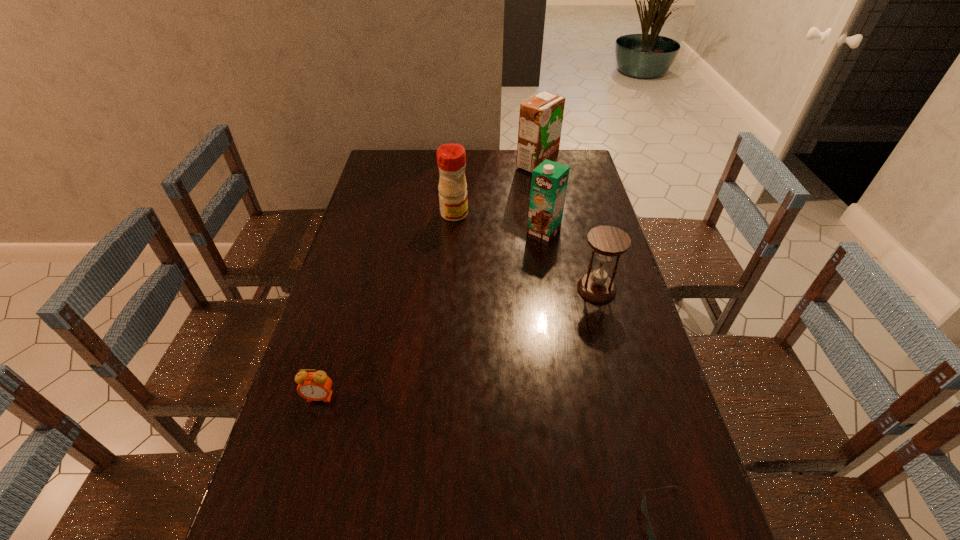
Locate an element on the screen. The width and height of the screenshot is (960, 540). vacant space located on the right of the second object from left to right is located at coordinates (512, 214).

You are a GUI agent. You are given a task and a screenshot of the screen. Output one action in this format:
    pyautogui.click(x=<x>, y=<y>)
    Task: Click on the free space located on the front of the nearer carton
    
    Given the screenshot: What is the action you would take?
    pyautogui.click(x=557, y=309)

Locate an element on the screen. vacant space situated 0.330m on the left of the third shortest object is located at coordinates (468, 289).

Where is `vacant area located 0.200m on the face of the fifth farthest object`? vacant area located 0.200m on the face of the fifth farthest object is located at coordinates (292, 489).

Where is `object at the far edge`? object at the far edge is located at coordinates (540, 120).

This screenshot has width=960, height=540. Identify the location of object that is positioned at the left edge. (314, 386).

Where is `carton at the right edge`? carton at the right edge is located at coordinates (540, 120).

Where is `hourglass located at the right edge`? hourglass located at the right edge is located at coordinates (607, 241).

Locate an element on the screen. The width and height of the screenshot is (960, 540). object positioned at the far right corner is located at coordinates (540, 120).

Locate an element on the screen. This screenshot has width=960, height=540. free region at the far edge is located at coordinates (477, 158).